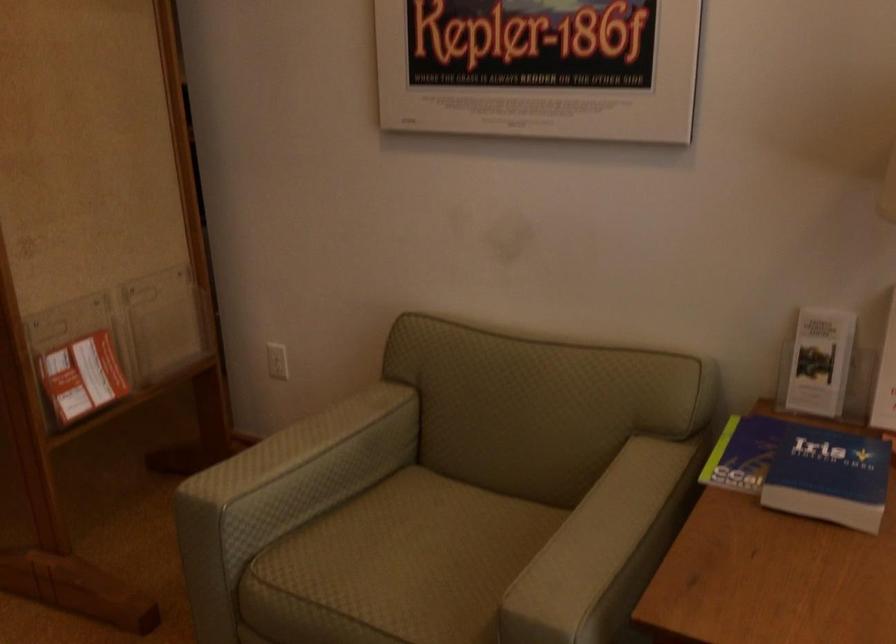
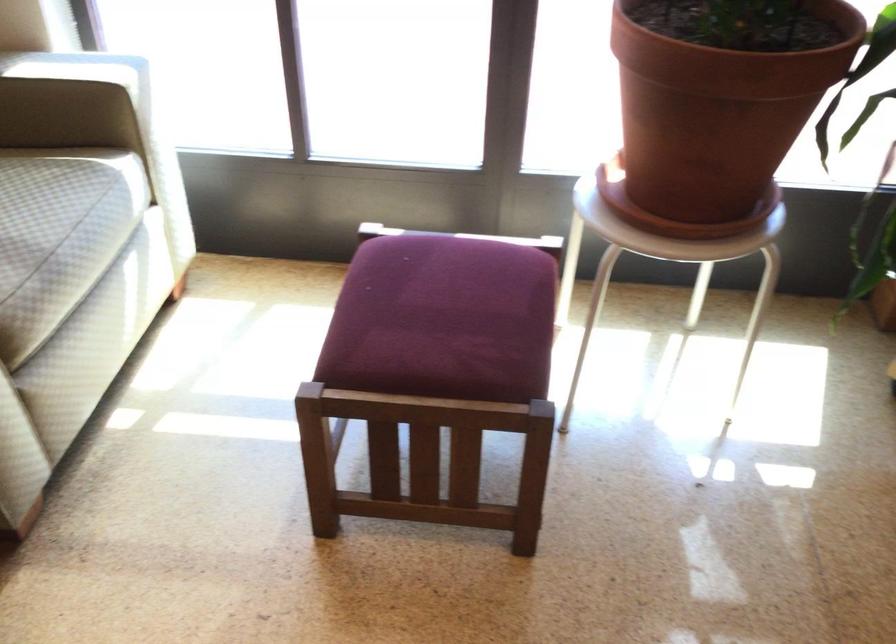
Consider the image. The first image is from the beginning of the video and the second image is from the end. How did the camera likely rotate when shooting the video?

The camera rotated toward right-down.